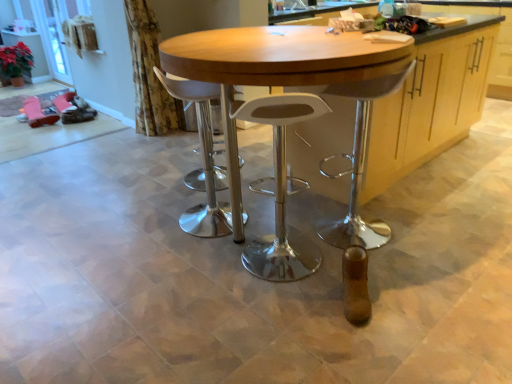
The image size is (512, 384). What are the coordinates of `vacant space in front of white plastic stool at center, the 1th stool from the right` in the screenshot? It's located at (279, 307).